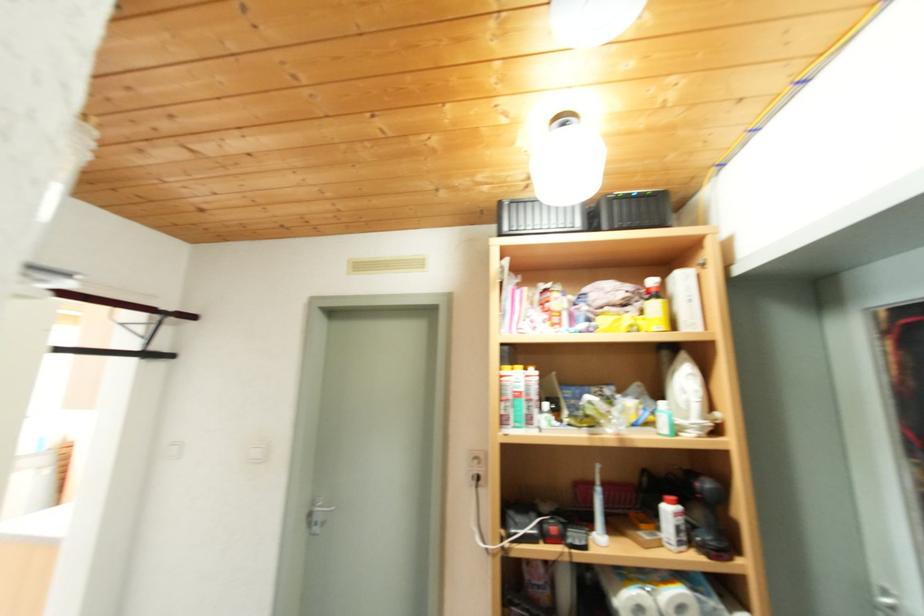
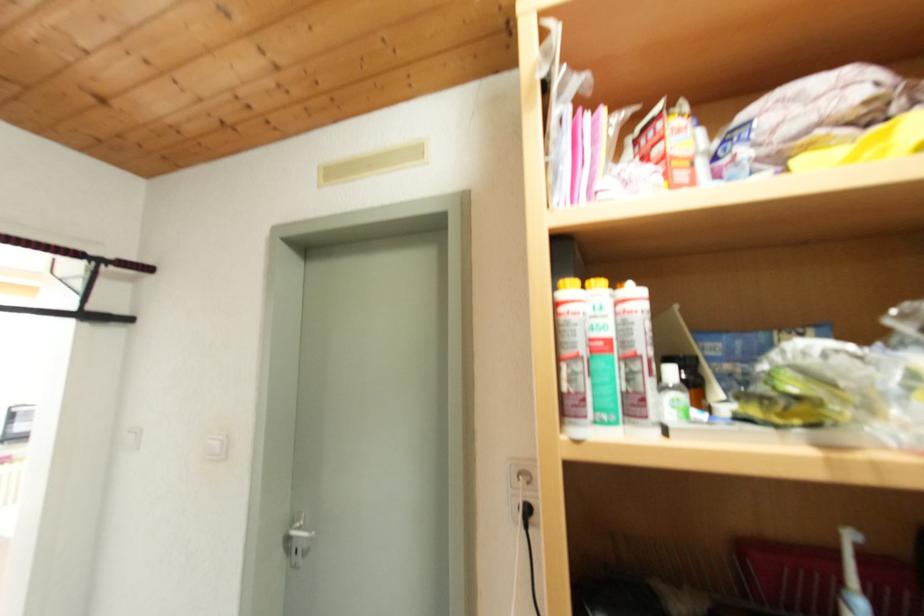
Question: The images are taken continuously from a first-person perspective. In which direction is your viewpoint rotating?

Choices:
 (A) Left
 (B) Right
 (C) Up
 (D) Down

Answer: (A)